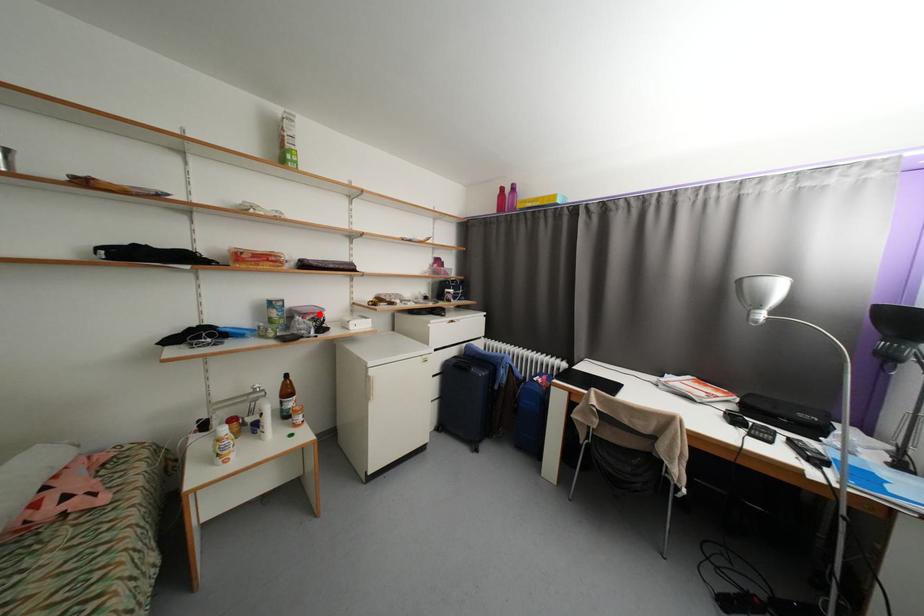
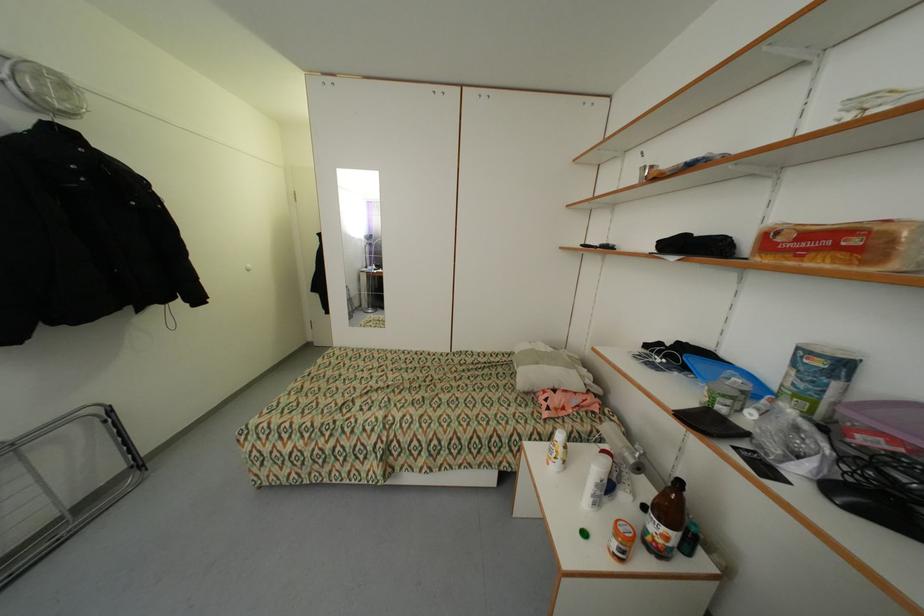
Find the pixel in the second image that matches the highlighted location in the first image.

(900, 440)